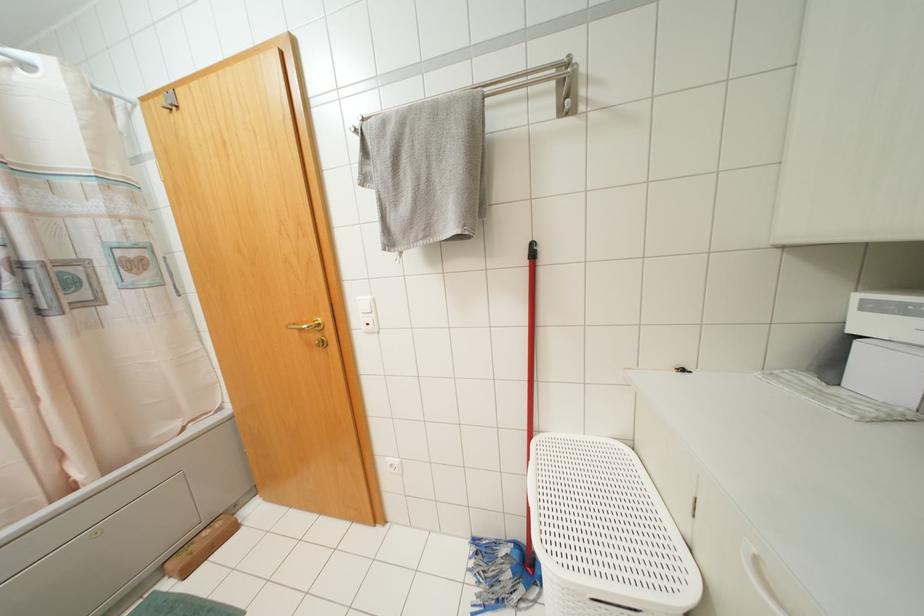
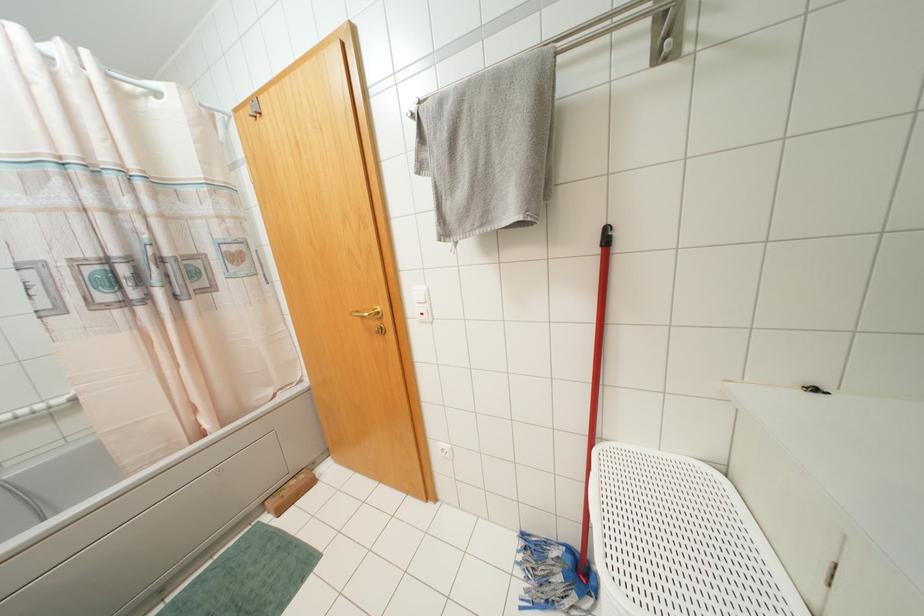
The images are taken continuously from a first-person perspective. In which direction are you moving?

The movement direction of the cameraman is left, forward.